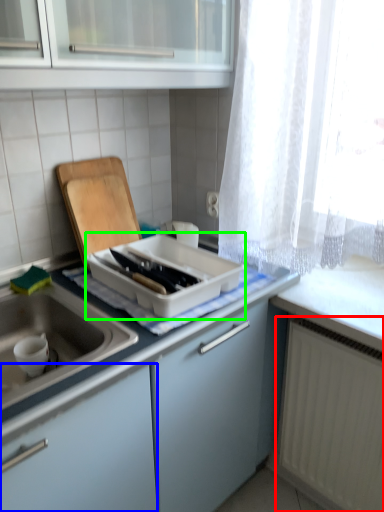
Question: Which is farther away from radiator (highlighted by a red box)? cabinetry (highlighted by a blue box) or kitchen appliance (highlighted by a green box)?

Choices:
 (A) cabinetry
 (B) kitchen appliance

Answer: (A)